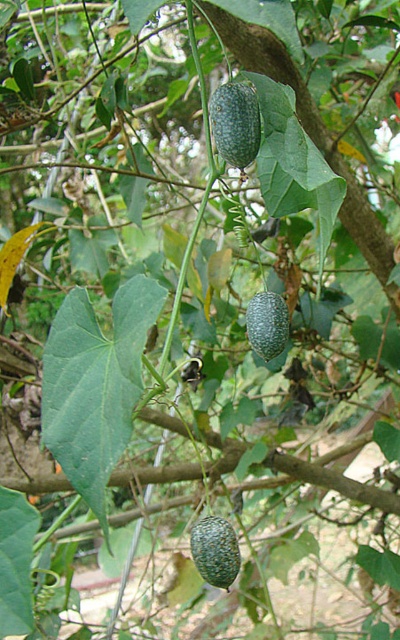
Question: Which object is farther from the camera taking this photo?

Choices:
 (A) speckled green avocado at center
 (B) green matte/glossy gourd at center

Answer: (B)

Question: Considering the relative positions of green speckled gourd at center and speckled green avocado at center in the image provided, where is green speckled gourd at center located with respect to speckled green avocado at center?

Choices:
 (A) above
 (B) below

Answer: (A)

Question: Is green speckled gourd at center wider than speckled green avocado at center?

Choices:
 (A) yes
 (B) no

Answer: (A)

Question: Which object is positioned farthest from the speckled green avocado at center?

Choices:
 (A) green matte/glossy gourd at center
 (B) green speckled gourd at center

Answer: (B)

Question: Does green speckled gourd at center have a smaller size compared to speckled green avocado at center?

Choices:
 (A) yes
 (B) no

Answer: (A)

Question: Which of these objects is positioned farthest from the green matte/glossy gourd at center?

Choices:
 (A) green speckled gourd at center
 (B) speckled green avocado at center

Answer: (B)